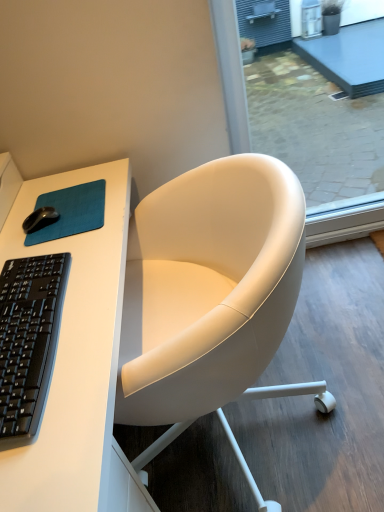
Locate an element on the screen. This screenshot has height=512, width=384. free space above teal fabric mousepad at upper left (from a real-world perspective) is located at coordinates (70, 215).